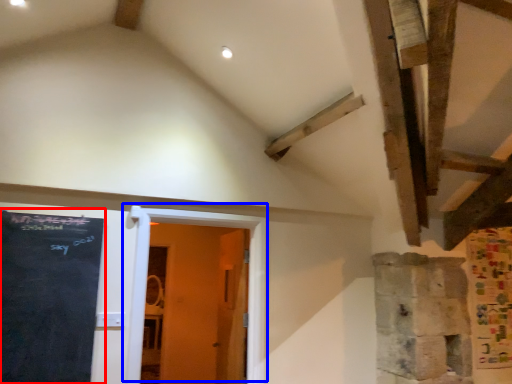
Question: Which object is further to the camera taking this photo, bulletin board (highlighted by a red box) or door (highlighted by a blue box)?

Choices:
 (A) bulletin board
 (B) door

Answer: (B)